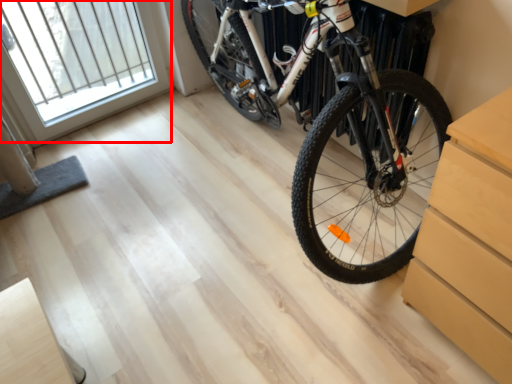
Question: From the image's perspective, where is window (annotated by the red box) located relative to bicycle?

Choices:
 (A) below
 (B) above

Answer: (B)